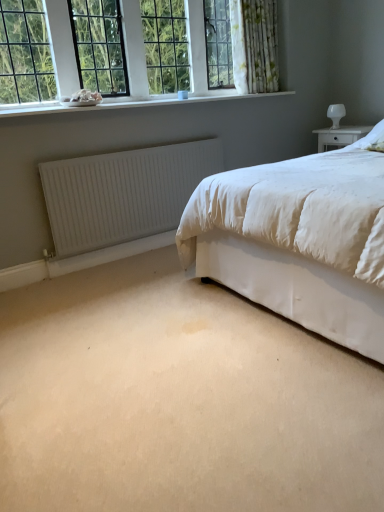
The image size is (384, 512). What do you see at coordinates (254, 45) in the screenshot?
I see `white floral fabric curtain at upper center` at bounding box center [254, 45].

What is the approximate width of white floral fabric curtain at upper center?

white floral fabric curtain at upper center is 9.88 inches wide.

Where is `white matte radiator at lower left`? This screenshot has height=512, width=384. white matte radiator at lower left is located at coordinates (123, 193).

I want to click on white glossy table lamp at upper right, so click(x=336, y=114).

Considering the positions of point (273, 15) and point (152, 164), is point (273, 15) closer or farther from the camera than point (152, 164)?

Point (273, 15) is positioned farther from the camera compared to point (152, 164).

Can you confirm if white floral fabric curtain at upper center is smaller than white matte radiator at lower left?

Actually, white floral fabric curtain at upper center might be larger than white matte radiator at lower left.

Can we say white floral fabric curtain at upper center lies outside white matte radiator at lower left?

Yes, white floral fabric curtain at upper center is not within white matte radiator at lower left.

Identify the location of curtain beneath the clear glass window at upper left (from a real-world perspective). This screenshot has height=512, width=384. tap(254, 45).

Is point (251, 18) positioned in front of point (76, 104)?

No.

Is white floral fabric curtain at upper center shorter than clear glass window at upper left?

No, white floral fabric curtain at upper center is not shorter than clear glass window at upper left.

From the picture: Considering the positions of objects white floral fabric curtain at upper center and clear glass window at upper left in the image provided, who is more to the right, white floral fabric curtain at upper center or clear glass window at upper left?

white floral fabric curtain at upper center.

How different are the orientations of clear glass window at upper left and white glossy table lamp at upper right in degrees?

clear glass window at upper left and white glossy table lamp at upper right are facing 89 degrees away from each other.

How much distance is there between clear glass window at upper left and white glossy table lamp at upper right?

They are 1.59 meters apart.

Considering the sizes of objects clear glass window at upper left and white glossy table lamp at upper right in the image provided, who is thinner, clear glass window at upper left or white glossy table lamp at upper right?

Thinner between the two is clear glass window at upper left.

Which object is further away from the camera, clear glass window at upper left or white glossy table lamp at upper right?

white glossy table lamp at upper right is further from the camera.

Looking at the image, does white matte radiator at lower left seem bigger or smaller compared to white floral fabric curtain at upper center?

In the image, white matte radiator at lower left appears to be smaller than white floral fabric curtain at upper center.

Relative to white floral fabric curtain at upper center, is white matte radiator at lower left in front or behind?

Visually, white matte radiator at lower left is located in front of white floral fabric curtain at upper center.

Identify the location of curtain positioned vertically above the white matte radiator at lower left (from a real-world perspective). This screenshot has width=384, height=512. (254, 45).

From a real-world perspective, is white matte radiator at lower left under white floral fabric curtain at upper center?

Yes, from a real-world perspective, white matte radiator at lower left is under white floral fabric curtain at upper center.

Is white smooth window sill at upper left facing away from white floral fabric curtain at upper center?

No.

From a real-world perspective, is white smooth window sill at upper left located higher than white floral fabric curtain at upper center?

No.

Does white smooth window sill at upper left lie behind white floral fabric curtain at upper center?

No, it is in front of white floral fabric curtain at upper center.

Considering the sizes of objects white smooth window sill at upper left and white floral fabric curtain at upper center in the image provided, who is thinner, white smooth window sill at upper left or white floral fabric curtain at upper center?

white floral fabric curtain at upper center is thinner.

From a real-world perspective, who is located lower, white glossy table lamp at upper right or clear glass window at upper left?

From a 3D spatial view, white glossy table lamp at upper right is below.

How different are the orientations of white glossy table lamp at upper right and clear glass window at upper left in degrees?

white glossy table lamp at upper right and clear glass window at upper left are facing 89 degrees away from each other.

Is point (332, 110) closer or farther from the camera than point (130, 18)?

Point (332, 110) is farther from the camera than point (130, 18).

Is white glossy table lamp at upper right directly adjacent to clear glass window at upper left?

No, white glossy table lamp at upper right is not with clear glass window at upper left.

Could white glossy table lamp at upper right be considered to be inside white floral fabric curtain at upper center?

No, white glossy table lamp at upper right is not a part of white floral fabric curtain at upper center.

Can you confirm if white floral fabric curtain at upper center is smaller than white glossy table lamp at upper right?

Actually, white floral fabric curtain at upper center might be larger than white glossy table lamp at upper right.

Is white floral fabric curtain at upper center facing towards white glossy table lamp at upper right?

No.

Where is `curtain above the white matte radiator at lower left (from the image's perspective)`? Image resolution: width=384 pixels, height=512 pixels. curtain above the white matte radiator at lower left (from the image's perspective) is located at coordinates (254, 45).

Locate an element on the screen. This screenshot has width=384, height=512. curtain below the clear glass window at upper left (from a real-world perspective) is located at coordinates (254, 45).

From the picture: Based on their spatial positions, is white floral fabric curtain at upper center or white smooth window sill at upper left further from white glossy table lamp at upper right?

Among the two, white smooth window sill at upper left is located further to white glossy table lamp at upper right.

Looking at the image, which one is located closer to white glossy table lamp at upper right, white floral fabric curtain at upper center or white matte radiator at lower left?

white floral fabric curtain at upper center.

Considering their positions, is white smooth window sill at upper left positioned closer to white floral fabric curtain at upper center than white matte radiator at lower left?

white smooth window sill at upper left lies closer to white floral fabric curtain at upper center than the other object.

Based on their spatial positions, is clear glass window at upper left or white matte radiator at lower left closer to white smooth window sill at upper left?

Based on the image, clear glass window at upper left appears to be nearer to white smooth window sill at upper left.

Which object lies nearer to the anchor point white matte radiator at lower left, clear glass window at upper left or white glossy table lamp at upper right?

clear glass window at upper left lies closer to white matte radiator at lower left than the other object.

Looking at this image, which object lies nearer to the anchor point white smooth window sill at upper left, clear glass window at upper left or white glossy table lamp at upper right?

clear glass window at upper left is closer to white smooth window sill at upper left.

Estimate the real-world distances between objects in this image. Which object is further from white matte radiator at lower left, white floral fabric curtain at upper center or white smooth window sill at upper left?

white floral fabric curtain at upper center is further to white matte radiator at lower left.

Estimate the real-world distances between objects in this image. Which object is further from clear glass window at upper left, white matte radiator at lower left or white floral fabric curtain at upper center?

white matte radiator at lower left lies further to clear glass window at upper left than the other object.

What are the coordinates of `window sill between white floral fabric curtain at upper center and white matte radiator at lower left vertically` in the screenshot? It's located at (127, 103).

Image resolution: width=384 pixels, height=512 pixels. What are the coordinates of `curtain located between white matte radiator at lower left and white glossy table lamp at upper right in the left-right direction` in the screenshot? It's located at (254, 45).

The width and height of the screenshot is (384, 512). What are the coordinates of `window sill between clear glass window at upper left and white matte radiator at lower left from top to bottom` in the screenshot? It's located at (127, 103).

Where is `radiator situated between clear glass window at upper left and white glossy table lamp at upper right from left to right`? The width and height of the screenshot is (384, 512). radiator situated between clear glass window at upper left and white glossy table lamp at upper right from left to right is located at coordinates (123, 193).